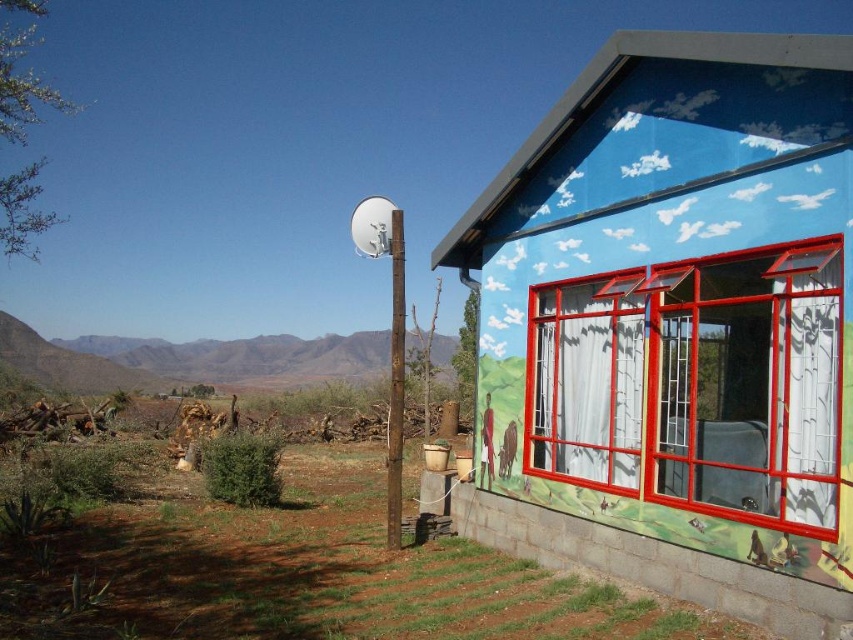
Question: Which point is farther to the camera?

Choices:
 (A) blue painted wall at upper right
 (B) clear glass window at right

Answer: (A)

Question: Is blue painted wall at upper right to the left of clear glass window at right from the viewer's perspective?

Choices:
 (A) no
 (B) yes

Answer: (B)

Question: Does blue painted wall at upper right appear on the left side of clear glass window at right?

Choices:
 (A) no
 (B) yes

Answer: (B)

Question: Is blue painted wall at upper right above clear glass window at right?

Choices:
 (A) no
 (B) yes

Answer: (B)